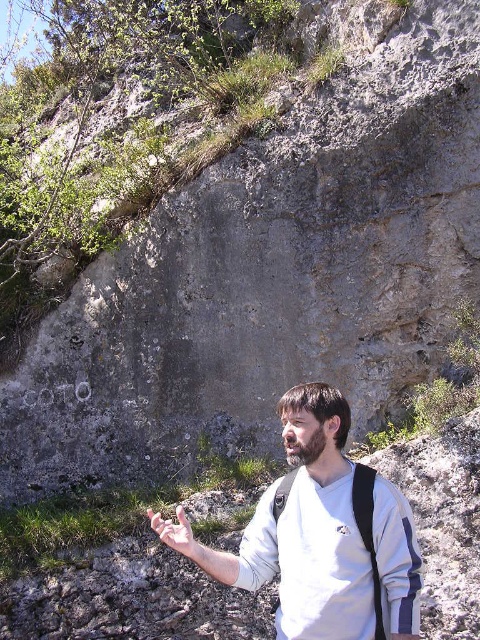
Can you confirm if white matte shirt at center is positioned below smooth skin hand at lower center?

No.

Between white matte shirt at center and smooth skin hand at lower center, which one is positioned lower?

smooth skin hand at lower center

Describe the element at coordinates (309, 529) in the screenshot. I see `white matte shirt at center` at that location.

Identify the location of white matte shirt at center. This screenshot has height=640, width=480. (309, 529).